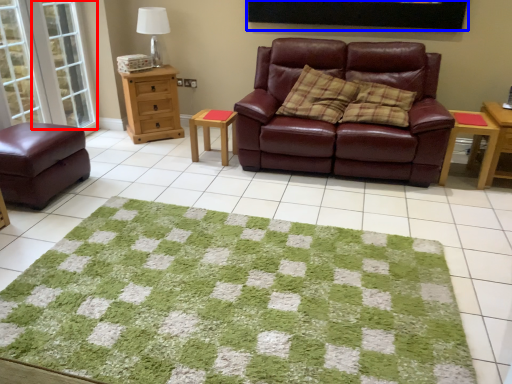
Question: Which object is further to the camera taking this photo, glass door (highlighted by a red box) or picture frame (highlighted by a blue box)?

Choices:
 (A) glass door
 (B) picture frame

Answer: (A)